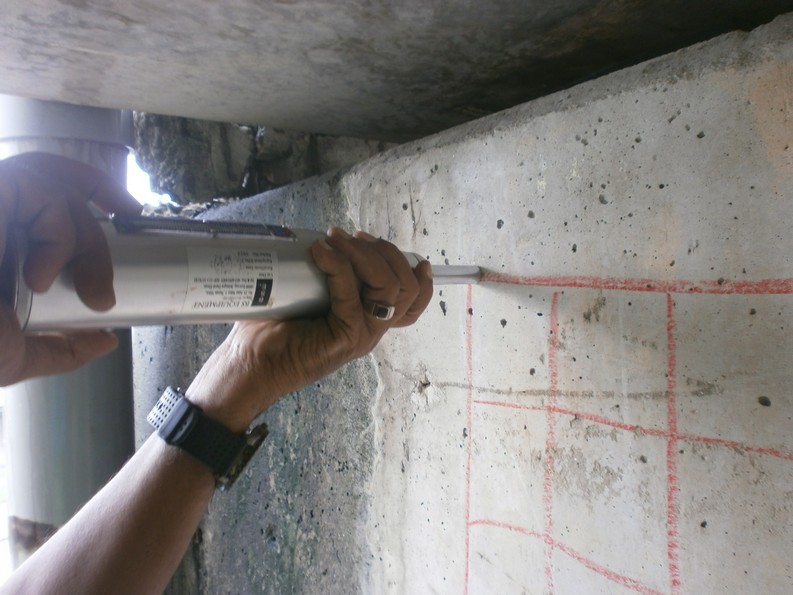
Locate an element on the screen. This screenshot has width=793, height=595. light is located at coordinates (140, 186).